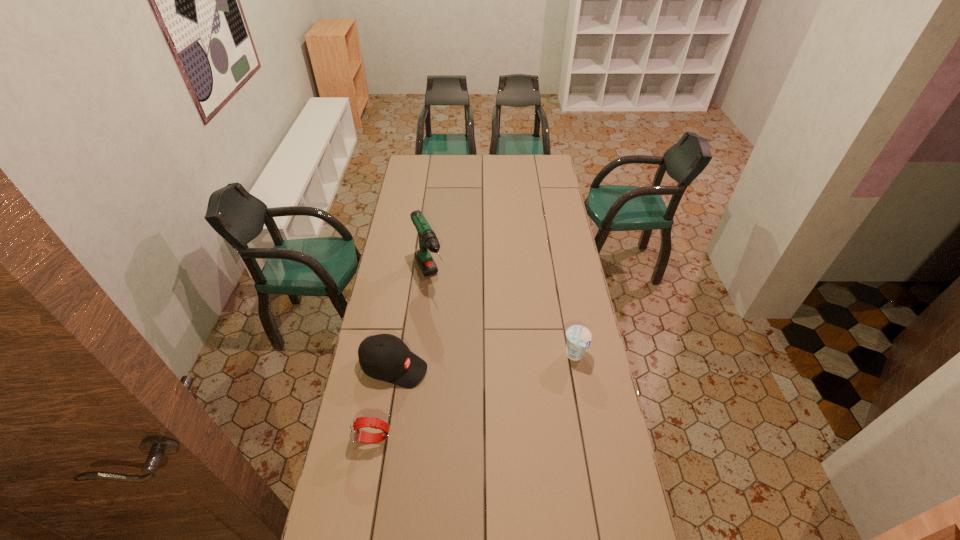
This screenshot has height=540, width=960. Identify the location of watch. (356, 434).

The width and height of the screenshot is (960, 540). What are the coordinates of `the rightmost object` in the screenshot? It's located at (579, 337).

Identify the location of baseball cap. (385, 357).

Image resolution: width=960 pixels, height=540 pixels. Identify the location of drill. (427, 238).

Locate an element on the screen. The width and height of the screenshot is (960, 540). the farthest object is located at coordinates (427, 238).

Identify the location of vacant region located on the front of the rightmost object. (582, 397).

Identify the location of free space located with a logo on the front of the baseball cap. (521, 406).

This screenshot has width=960, height=540. What are the coordinates of `vacant space situated 0.110m with a logo on the front of the baseball cap` in the screenshot? It's located at (452, 383).

This screenshot has width=960, height=540. What are the coordinates of `free space located with a logo on the front of the baseball cap` in the screenshot? It's located at (521, 406).

Where is `free region located 0.250m on the handle side of the drill`? free region located 0.250m on the handle side of the drill is located at coordinates (457, 343).